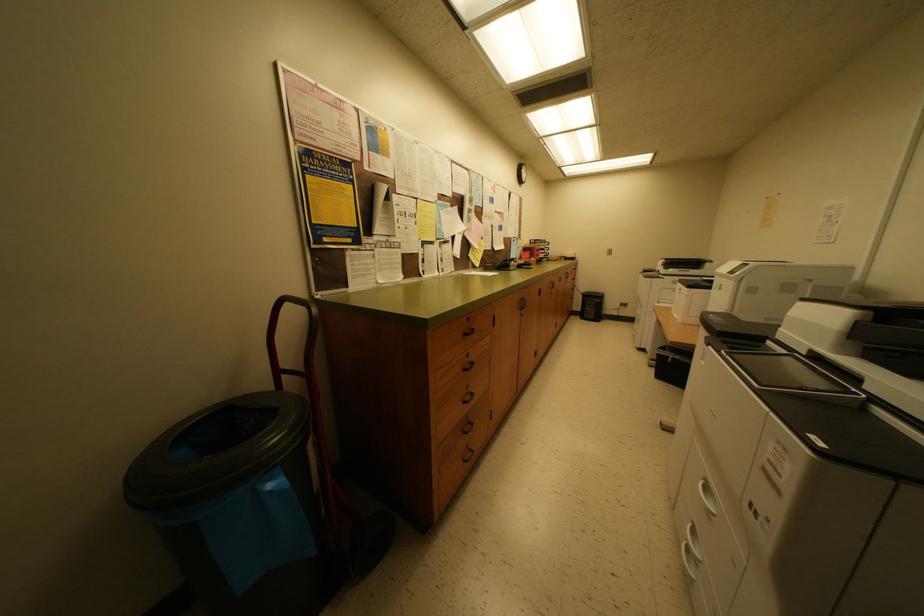
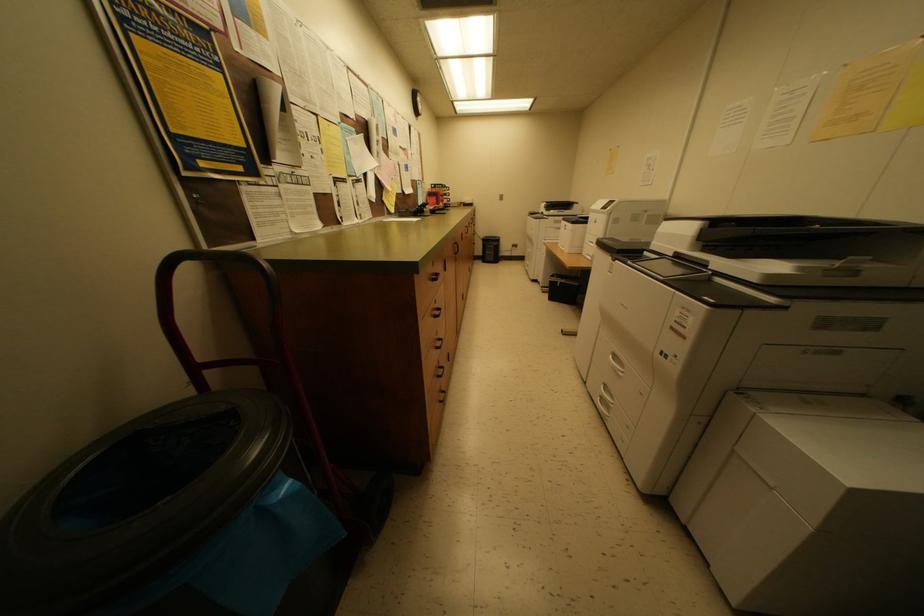
Question: In a continuous first-person perspective shot, in which direction is the camera moving?

Choices:
 (A) Left
 (B) Right
 (C) Forward
 (D) Backward

Answer: (A)